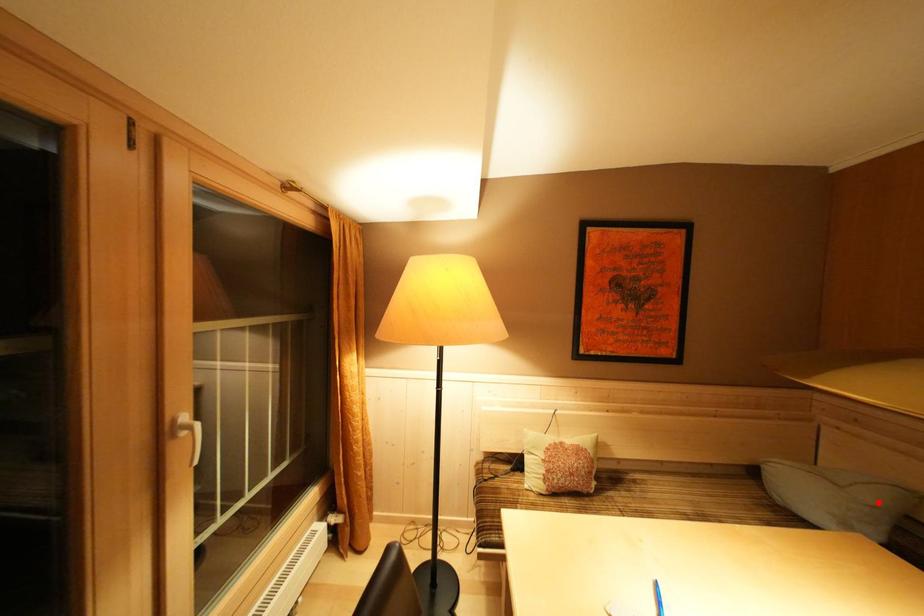
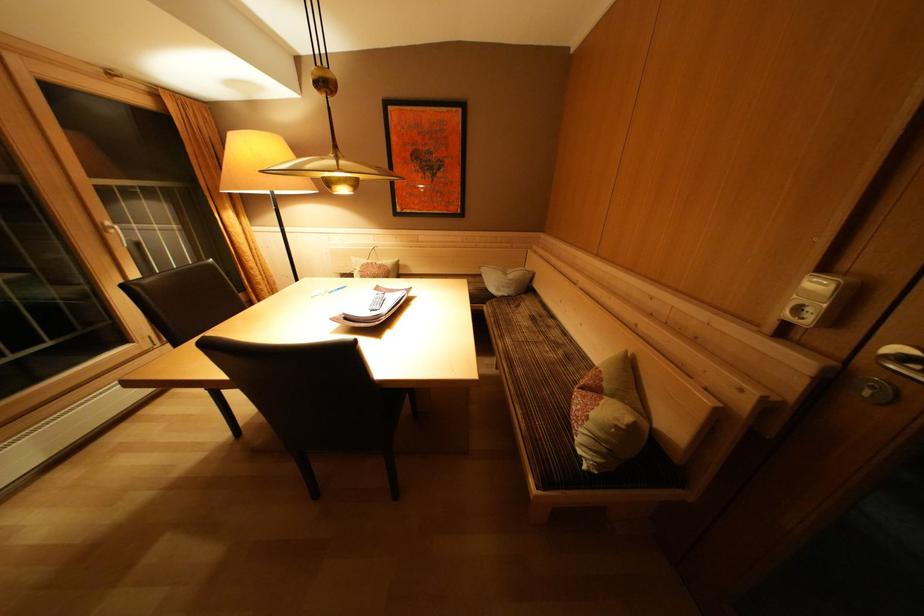
Find the pixel in the second image that matches the highlighted location in the first image.

(517, 281)